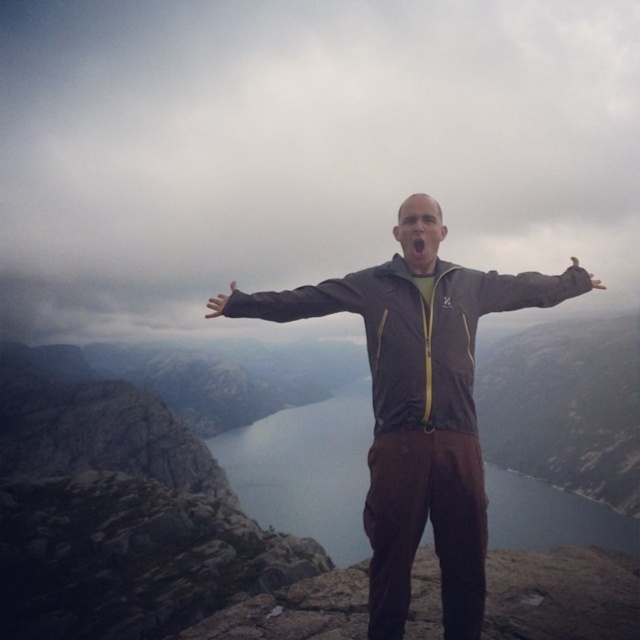
Is smooth blue water at center bigger than brown leather glove at upper right?

Correct, smooth blue water at center is larger in size than brown leather glove at upper right.

Looking at this image, does smooth blue water at center appear under brown leather glove at upper right?

Yes, smooth blue water at center is below brown leather glove at upper right.

Is point (332, 461) closer to viewer compared to point (595, 285)?

No, (332, 461) is further to viewer.

Locate an element on the screen. smooth blue water at center is located at coordinates (305, 470).

Does brown matte jacket at center have a greater width compared to smooth blue water at center?

No.

Is brown matte jacket at center smaller than smooth blue water at center?

Yes, brown matte jacket at center is smaller than smooth blue water at center.

What do you see at coordinates (422, 428) in the screenshot? I see `brown matte jacket at center` at bounding box center [422, 428].

I want to click on brown matte jacket at center, so click(422, 428).

Is dark gray fabric arm at center above brown leather glove at upper right?

Actually, dark gray fabric arm at center is below brown leather glove at upper right.

Can you confirm if dark gray fabric arm at center is taller than brown leather glove at upper right?

Incorrect, dark gray fabric arm at center's height is not larger of brown leather glove at upper right's.

Which is in front, point (262, 316) or point (604, 288)?

Point (262, 316) is in front.

The width and height of the screenshot is (640, 640). Identify the location of dark gray fabric arm at center. coord(292,300).